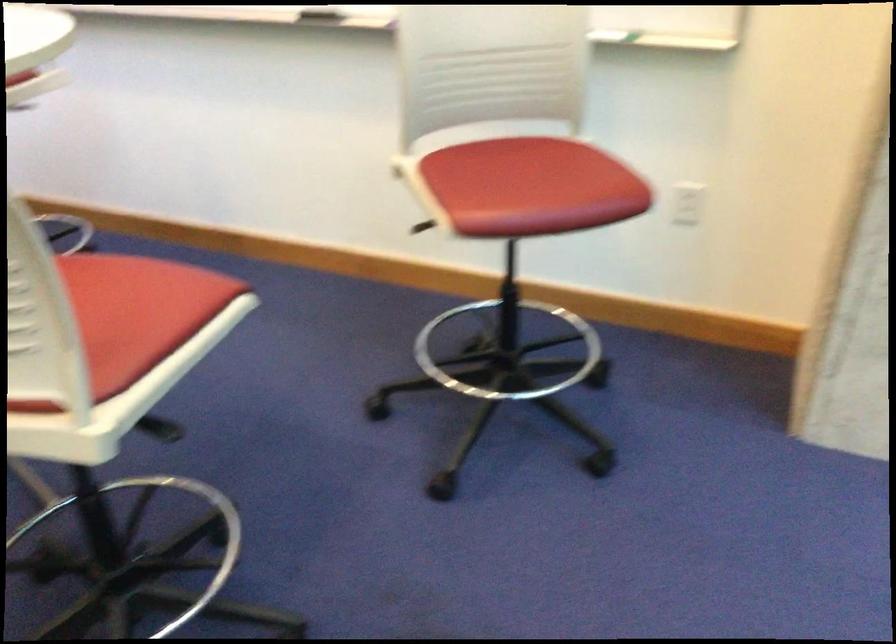
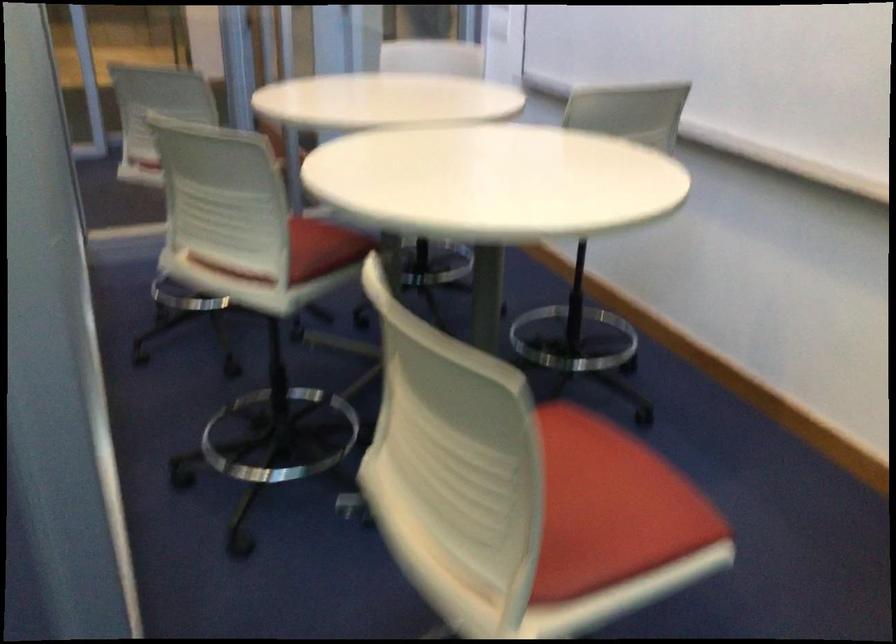
Where in the second image is the point corresponding to (x=135, y=299) from the first image?

(609, 507)